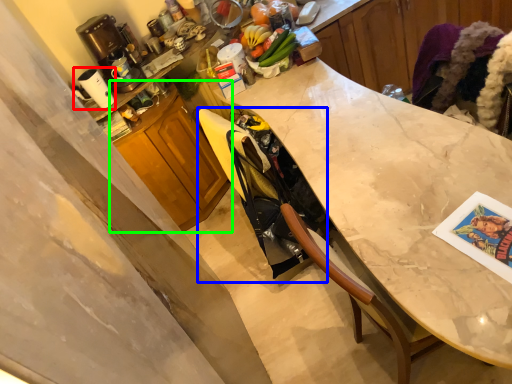
Question: Which object is positioned closest to appliance (highlighted by a red box)? Select from swivel chair (highlighted by a blue box) and cabinetry (highlighted by a green box).

Choices:
 (A) swivel chair
 (B) cabinetry

Answer: (B)